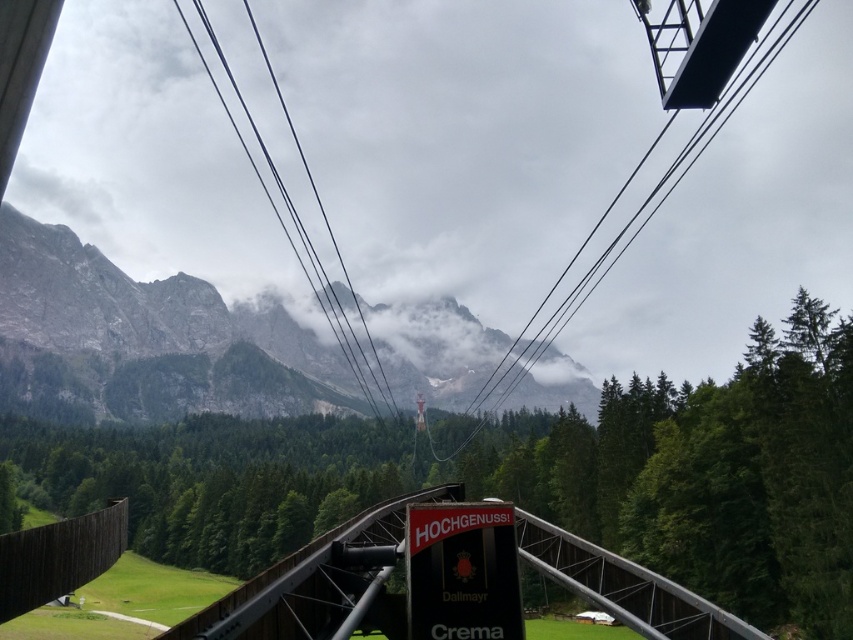
You are a tourist riding a cable car and looking out the window. You see a metallic bridge at center and a metallic wire at upper center. Which object is positioned higher in your field of view?

The metallic wire at upper center is positioned higher in your field of view than the metallic bridge at center.

You are a maintenance worker checking the cable car system. You notice two wires in the image. Which wire is wider in width between the metallic wire at upper center and the black wire at center?

The metallic wire at upper center is wider in width than the black wire at center.

You are a tourist on a cable car ride and you notice two metallic structures ahead. The first is the metallic bridge at center and the second is the metallic wire at upper center. Which one is longer?

The metallic wire at upper center is longer than the metallic bridge at center.